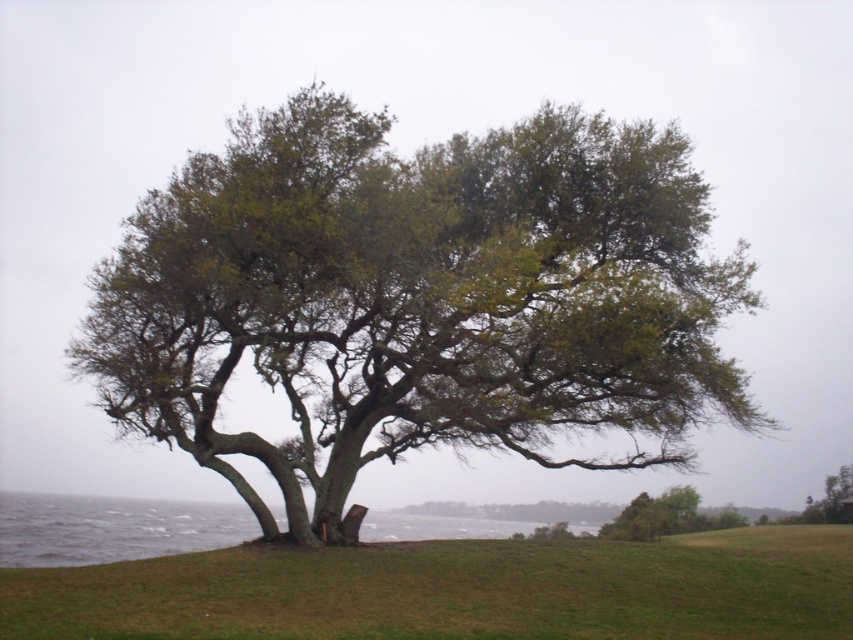
Question: Which point is farther from the camera taking this photo?

Choices:
 (A) (590, 577)
 (B) (430, 532)

Answer: (B)

Question: Which object is the farthest from the green water at lower left?

Choices:
 (A) green leafy tree at center
 (B) green grassy at lower center

Answer: (A)

Question: Which object is positioned farthest from the green water at lower left?

Choices:
 (A) green leafy tree at center
 (B) green grassy at lower center

Answer: (A)

Question: Can you confirm if green leafy tree at center is positioned below green grassy at lower center?

Choices:
 (A) no
 (B) yes

Answer: (A)

Question: Is green leafy tree at center in front of green water at lower left?

Choices:
 (A) no
 (B) yes

Answer: (B)

Question: Does green leafy tree at center have a lesser width compared to green grassy at lower center?

Choices:
 (A) no
 (B) yes

Answer: (B)